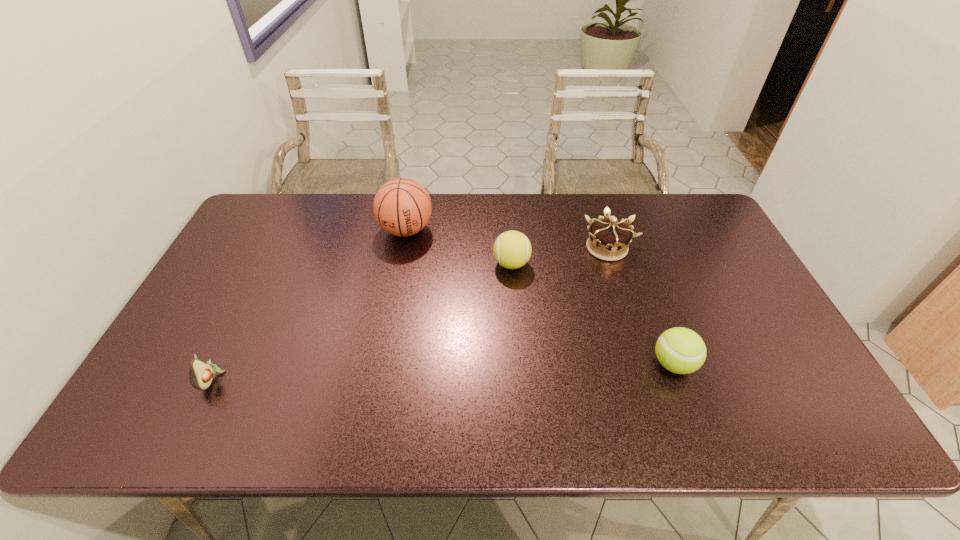
Where is `object identified as the third closest to the leftmost object`? This screenshot has height=540, width=960. object identified as the third closest to the leftmost object is located at coordinates (612, 237).

This screenshot has height=540, width=960. I want to click on vacant space that satisfies the following two spatial constraints: 1. on the surface of the second object from left to right near the brand logo; 2. on the left side of the crown, so click(403, 248).

Locate an element on the screen. The image size is (960, 540). free spot that satisfies the following two spatial constraints: 1. on the surface of the third object from right to left near the brand logo; 2. on the right side of the fourth object from right to left is located at coordinates (399, 264).

The width and height of the screenshot is (960, 540). I want to click on vacant area in the image that satisfies the following two spatial constraints: 1. on the front side of the crown; 2. on the left side of the nearer tennis ball, so click(642, 364).

The height and width of the screenshot is (540, 960). In order to click on free location that satisfies the following two spatial constraints: 1. on the front side of the left tennis ball; 2. on the left side of the right tennis ball in this screenshot , I will do `click(518, 364)`.

Identify the location of free region that satisfies the following two spatial constraints: 1. on the surface of the tallest object near the brand logo; 2. on the right side of the crown. (403, 248).